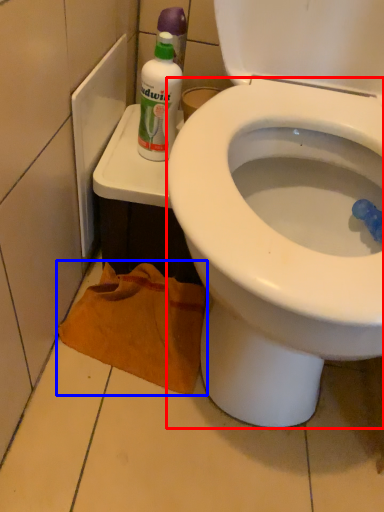
Question: Which point is further to the camera, bidet (highlighted by a red box) or material (highlighted by a blue box)?

Choices:
 (A) bidet
 (B) material

Answer: (B)